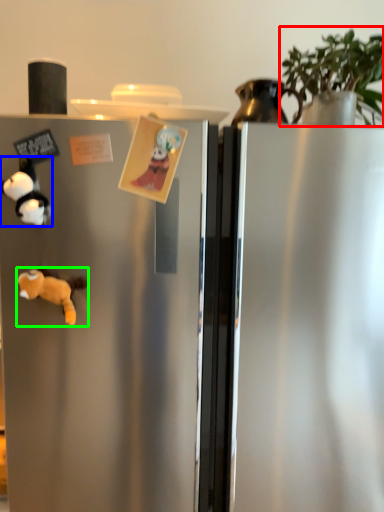
Question: Based on their relative distances, which object is nearer to plant (highlighted by a red box)? Choose from toy (highlighted by a blue box) and animal (highlighted by a green box).

Choices:
 (A) toy
 (B) animal

Answer: (A)